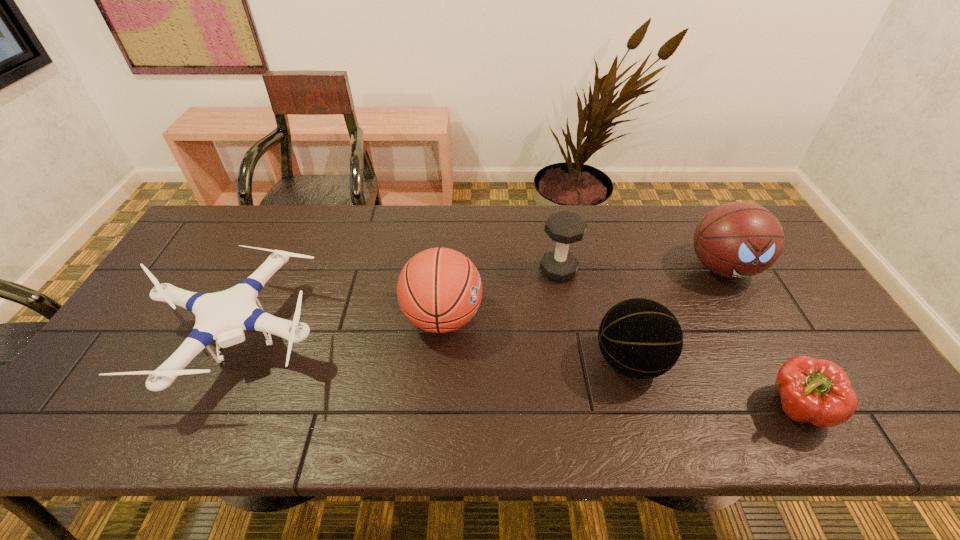
The image size is (960, 540). Find the location of `object positioned at the near right corner`. object positioned at the near right corner is located at coordinates (815, 391).

Locate an element on the screen. vacant region at the far edge of the desktop is located at coordinates (578, 248).

Identify the location of free space at the near edge. This screenshot has height=540, width=960. (196, 429).

Locate an element on the screen. This screenshot has width=960, height=540. vacant space at the right edge is located at coordinates (850, 362).

You are a GUI agent. You are given a task and a screenshot of the screen. Output one action in this format:
    pyautogui.click(x=<x>, y=<y>)
    Task: Click on the blank space at the near right corner of the desktop
    
    Given the screenshot: What is the action you would take?
    pyautogui.click(x=907, y=436)

Find the location of a particular element. Image resolution: width=960 pixels, height=540 pixels. free point between the rightmost basketball and the dumbbell is located at coordinates (640, 269).

In order to click on empty space between the leftmost object and the second basketball from left to right in this screenshot , I will do `click(432, 350)`.

Locate an element on the screen. The image size is (960, 540). unoccupied position between the leftmost basketball and the rightmost basketball is located at coordinates (583, 293).

Locate an element on the screen. This screenshot has height=540, width=960. free space between the rightmost basketball and the second basketball from left to right is located at coordinates (677, 314).

The width and height of the screenshot is (960, 540). I want to click on vacant space that's between the second object from left to right and the shortest basketball, so click(537, 339).